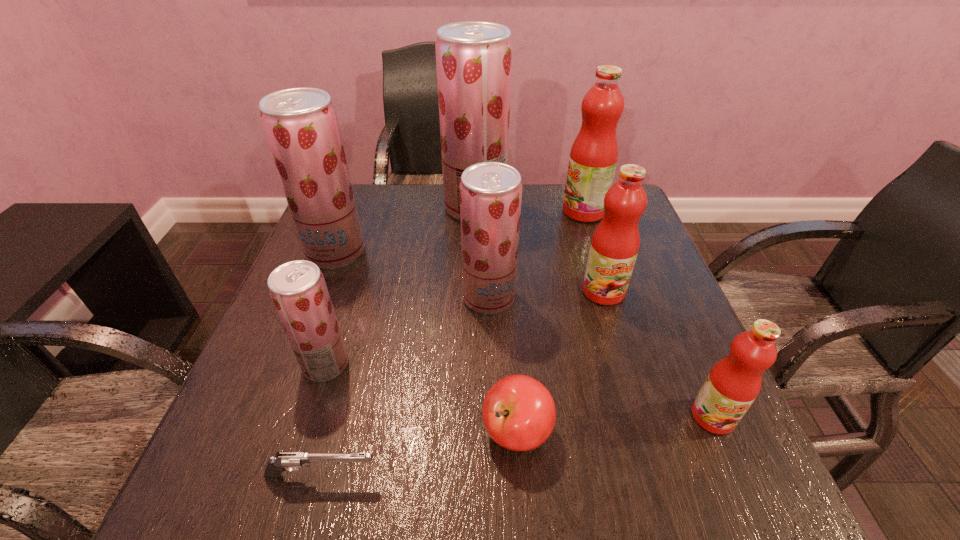
Identify the location of blank area located on the front label of the second farthest pink fruit juice. (634, 390).

Find the location of a particular element. vacant space located 0.280m on the front of the third farthest strawberry fruit juice is located at coordinates (492, 443).

At what (x,y) coordinates should I click in order to perform the action: click on vacant space located 0.340m on the right of the fourth nearest object. Please return your answer as a coordinate pair (x, y). Looking at the image, I should click on (529, 364).

The height and width of the screenshot is (540, 960). Find the location of `free space located 0.100m on the front label of the rightmost fruit juice`. free space located 0.100m on the front label of the rightmost fruit juice is located at coordinates click(x=749, y=499).

At what (x,y) coordinates should I click in order to perform the action: click on vacant point located 0.340m on the left of the apple. Please return your answer as a coordinate pair (x, y). Looking at the image, I should click on (277, 432).

You are a GUI agent. You are given a task and a screenshot of the screen. Output one action in this format:
    pyautogui.click(x=<x>, y=<y>)
    Task: Click on the blank space located 0.130m on the front-facing side of the pistol
    The height and width of the screenshot is (540, 960).
    Given the screenshot: What is the action you would take?
    pyautogui.click(x=463, y=476)

You are a GUI agent. You are given a task and a screenshot of the screen. Output one action in this format:
    pyautogui.click(x=<x>, y=<y>)
    Task: Click on the apple at the near edge
    
    Given the screenshot: What is the action you would take?
    pyautogui.click(x=519, y=414)

Find the location of a particular element. The height and width of the screenshot is (540, 960). pistol positioned at the near edge is located at coordinates (291, 461).

The image size is (960, 540). I want to click on pistol situated at the left edge, so click(x=291, y=461).

Find the location of `object that is at the near left corner`. object that is at the near left corner is located at coordinates (291, 461).